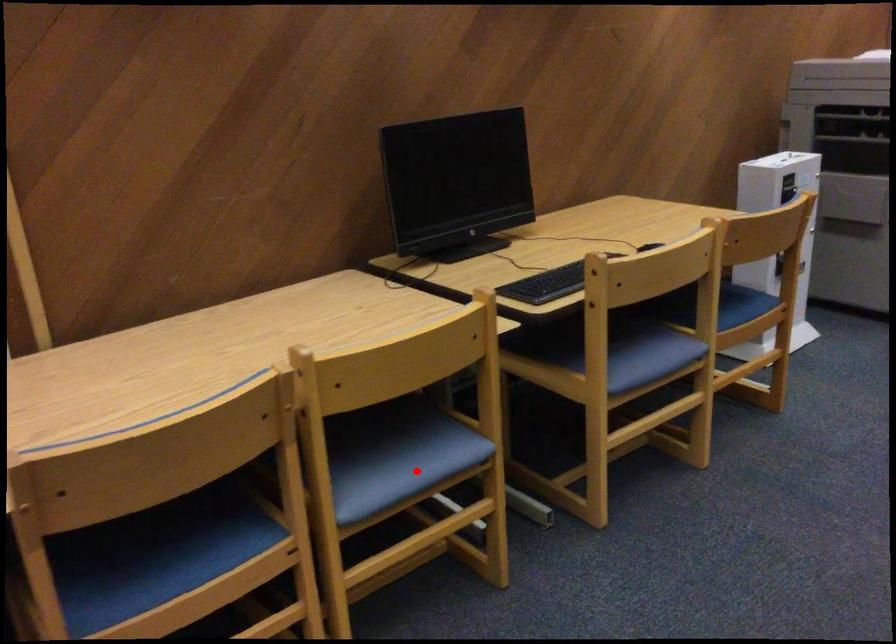
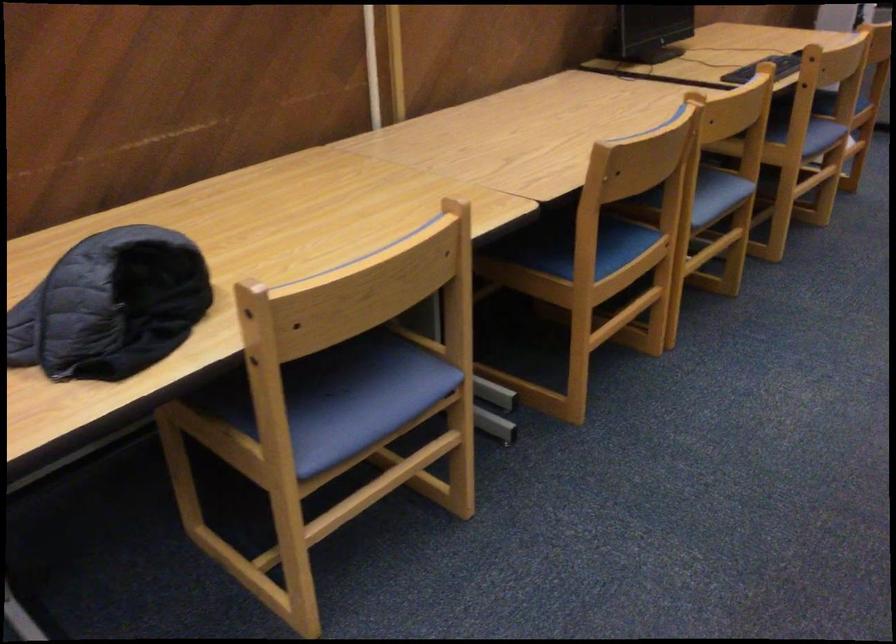
In the second image, find the point that corresponds to the highlighted location in the first image.

(718, 194)